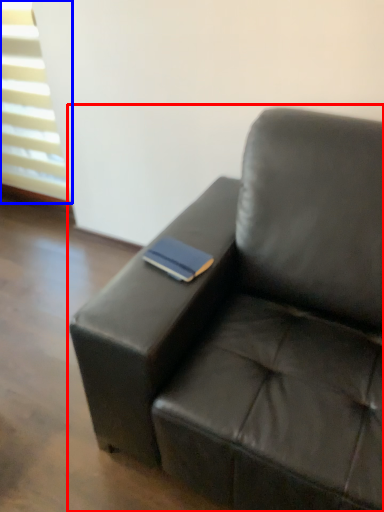
Question: Which point is further to the camera, studio couch (highlighted by a red box) or window (highlighted by a blue box)?

Choices:
 (A) studio couch
 (B) window

Answer: (B)